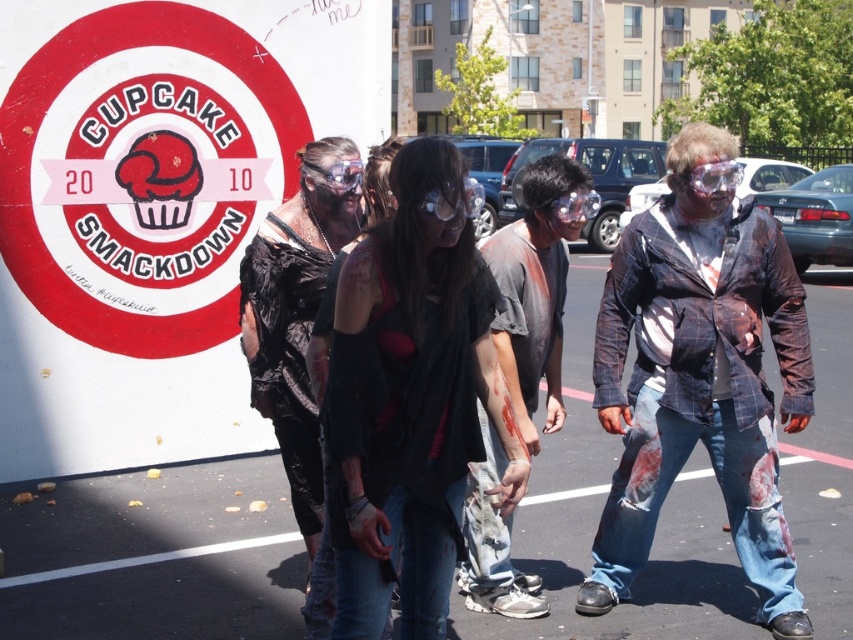
Consider the image. In the Cupcake Smackdown 2010 event scene, you see a person wearing distressed denim jeans at center and holding a black plastic bag at center. From the perspective of someone standing in front of them, which item is positioned to the left?

The black plastic bag at center is to the left of the distressed denim jeans at center.

What is located at the coordinates point (537,285) in the image?

The point (537,285) has distressed denim jeans at center located there.

You are a costume designer inspecting the outfit of a zombie character in the Cupcake Smackdown 2010 event. The outfit has a black mesh vest at center and a black plastic bag at center. Which item is closer to the bottom of the costume?

The black mesh vest at center is positioned under the black plastic bag at center, so it is closer to the bottom of the costume.